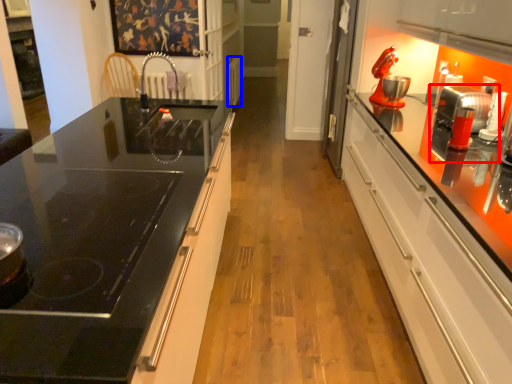
Question: Among these objects, which one is nearest to the camera, appliance (highlighted by a red box) or appliance (highlighted by a blue box)?

Choices:
 (A) appliance
 (B) appliance

Answer: (A)